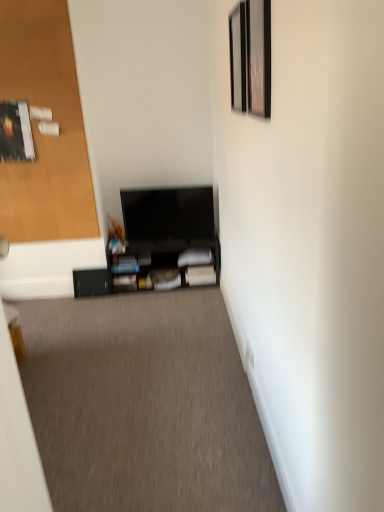
Question: Does black matte tv at center contain metallic silver picture frame at upper right, acting as the 1th picture frame starting from the front?

Choices:
 (A) no
 (B) yes

Answer: (A)

Question: From the image's perspective, is black matte tv at center above metallic silver picture frame at upper right, placed as the 2th picture frame when sorted from back to front?

Choices:
 (A) no
 (B) yes

Answer: (A)

Question: Does black matte tv at center have a larger size compared to metallic silver picture frame at upper right, acting as the 1th picture frame starting from the front?

Choices:
 (A) no
 (B) yes

Answer: (B)

Question: Is black matte tv at center outside of metallic silver picture frame at upper right, placed as the 2th picture frame when sorted from back to front?

Choices:
 (A) yes
 (B) no

Answer: (A)

Question: From a real-world perspective, is black matte tv at center located beneath metallic silver picture frame at upper right, acting as the 1th picture frame starting from the front?

Choices:
 (A) no
 (B) yes

Answer: (B)

Question: From the image's perspective, is metallic silver picture frame at upper right, acting as the 1th picture frame starting from the front, located above or below wooden door at left?

Choices:
 (A) above
 (B) below

Answer: (B)

Question: Is metallic silver picture frame at upper right, placed as the 2th picture frame when sorted from back to front, wider or thinner than wooden door at left?

Choices:
 (A) wide
 (B) thin

Answer: (B)

Question: Is metallic silver picture frame at upper right, acting as the 1th picture frame starting from the front, taller or shorter than wooden door at left?

Choices:
 (A) short
 (B) tall

Answer: (A)

Question: Does point [261, 60] appear closer or farther from the camera than point [46, 51]?

Choices:
 (A) closer
 (B) farther

Answer: (A)

Question: From a real-world perspective, relative to matte black shelf at center, arranged as the 2th shelf when viewed from the left, is black matte tv at center vertically above or below?

Choices:
 (A) above
 (B) below

Answer: (B)

Question: Is black matte tv at center taller or shorter than matte black shelf at center, arranged as the 2th shelf when viewed from the left?

Choices:
 (A) tall
 (B) short

Answer: (B)

Question: Would you say black matte tv at center is inside or outside matte black shelf at center, arranged as the 2th shelf when viewed from the left?

Choices:
 (A) outside
 (B) inside

Answer: (A)

Question: Would you say black matte tv at center is to the left or to the right of matte black shelf at center, which is the 1th shelf in right-to-left order, in the picture?

Choices:
 (A) right
 (B) left

Answer: (B)

Question: Choose the correct answer: Is wooden picture frame at upper right, placed as the 2th picture frame when sorted from front to back, inside black matte shelf at lower center, acting as the 1th shelf starting from the left, or outside it?

Choices:
 (A) outside
 (B) inside

Answer: (A)

Question: Is wooden picture frame at upper right, placed as the 2th picture frame when sorted from front to back, taller or shorter than black matte shelf at lower center, which is the second shelf in right-to-left order?

Choices:
 (A) tall
 (B) short

Answer: (A)